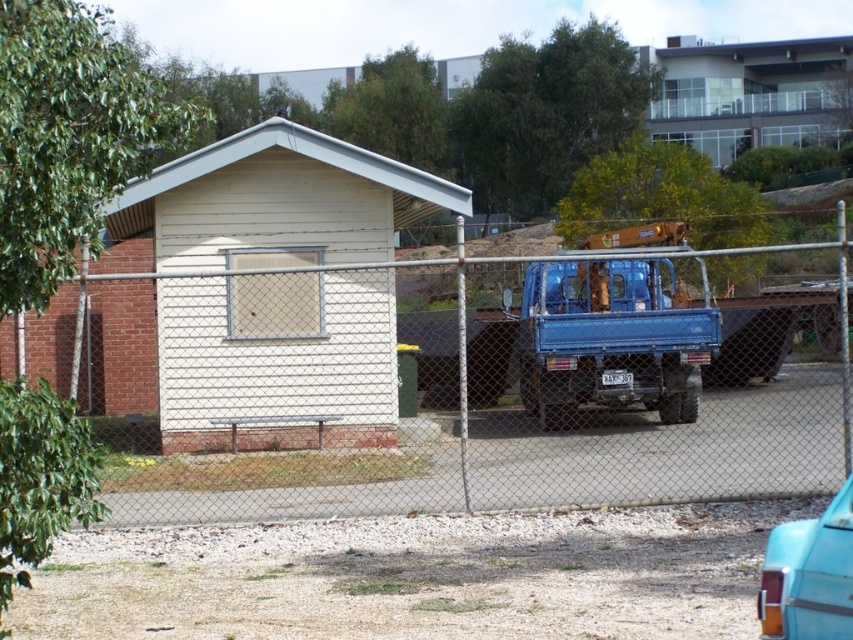
Question: Can you confirm if blue matte truck at center is bigger than teal glossy car at lower right?

Choices:
 (A) yes
 (B) no

Answer: (B)

Question: Does metal chain-link fence at center appear under blue matte truck at center?

Choices:
 (A) yes
 (B) no

Answer: (B)

Question: Is the position of metal chain-link fence at center less distant than that of blue matte truck at center?

Choices:
 (A) yes
 (B) no

Answer: (A)

Question: Which is nearer to the blue matte truck at center?

Choices:
 (A) teal glossy car at lower right
 (B) metal chain-link fence at center

Answer: (B)

Question: Based on their relative distances, which object is nearer to the blue matte truck at center?

Choices:
 (A) teal glossy car at lower right
 (B) metal chain-link fence at center

Answer: (B)

Question: Estimate the real-world distances between objects in this image. Which object is farther from the blue matte truck at center?

Choices:
 (A) teal glossy car at lower right
 (B) metal chain-link fence at center

Answer: (A)